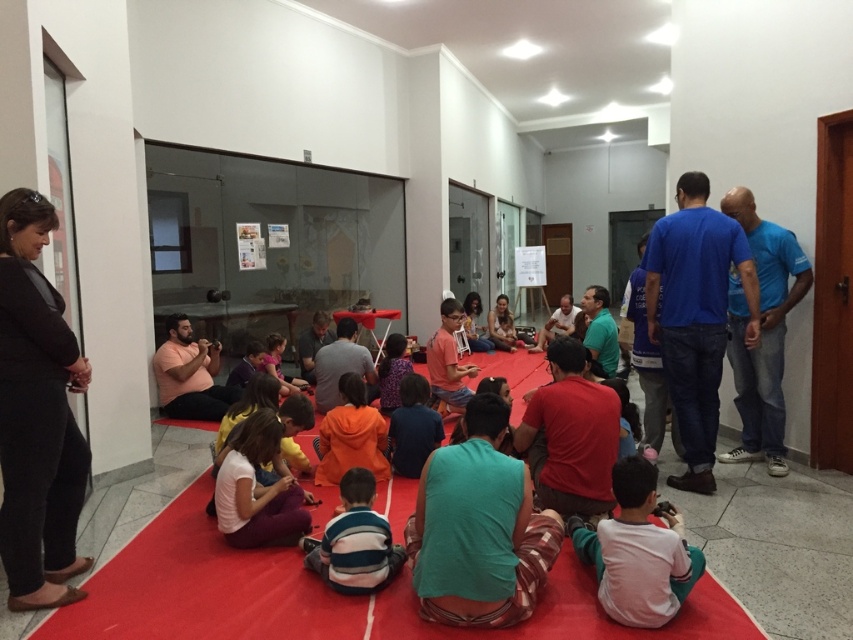
Question: Which of the following is the closest to the observer?

Choices:
 (A) (786, 312)
 (B) (589, 408)
 (C) (671, 513)
 (D) (424, 436)

Answer: (C)

Question: Which point appears closest to the camera in this image?

Choices:
 (A) (340, 481)
 (B) (611, 544)

Answer: (B)

Question: In this image, where is striped cotton shirt at center located relative to dark blue shirt at center?

Choices:
 (A) left
 (B) right

Answer: (A)

Question: Is blue t-shirt at right thinner than dark blue shirt at center?

Choices:
 (A) no
 (B) yes

Answer: (A)

Question: Does blue t-shirt at right appear on the right side of dark blue shirt at center?

Choices:
 (A) no
 (B) yes

Answer: (B)

Question: Which of the following is the closest to the observer?

Choices:
 (A) (659, 602)
 (B) (33, 506)
 (C) (582, 497)
 (D) (352, 529)

Answer: (A)